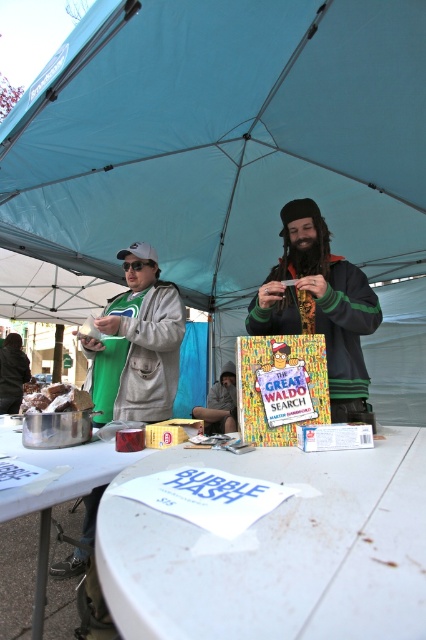
Consider the image. Is blue fabric canopy at upper center positioned behind white crumbly cake at center?

That is True.

Can you confirm if blue fabric canopy at upper center is smaller than white crumbly cake at center?

No.

Which is in front, point (176, 115) or point (46, 394)?

Point (46, 394)

Locate an element on the screen. blue fabric canopy at upper center is located at coordinates (221, 140).

Does green fabric jacket at left appear under white crumbly cake at center?

No, green fabric jacket at left is not below white crumbly cake at center.

Is green fabric jacket at left above white crumbly cake at center?

Yes, green fabric jacket at left is above white crumbly cake at center.

Find the location of `green fabric jacket at left`. green fabric jacket at left is located at coordinates (137, 344).

The image size is (426, 640). Identify the location of green fabric jacket at left. (137, 344).

Is green fabric jacket at center further to the viewer compared to matte plastic book at center?

No, it is in front of matte plastic book at center.

Who is positioned more to the left, green fabric jacket at center or matte plastic book at center?

matte plastic book at center

Is point (337, 413) closer to camera compared to point (221, 429)?

Yes, it is.

Image resolution: width=426 pixels, height=640 pixels. Identify the location of green fabric jacket at center. (319, 305).